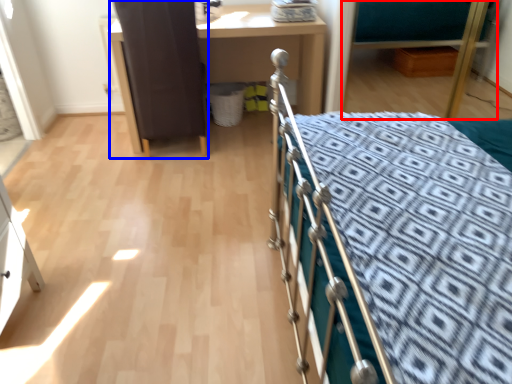
Question: Which point is further to the camera, hospital bed (highlighted by a red box) or screen door (highlighted by a blue box)?

Choices:
 (A) hospital bed
 (B) screen door

Answer: (A)